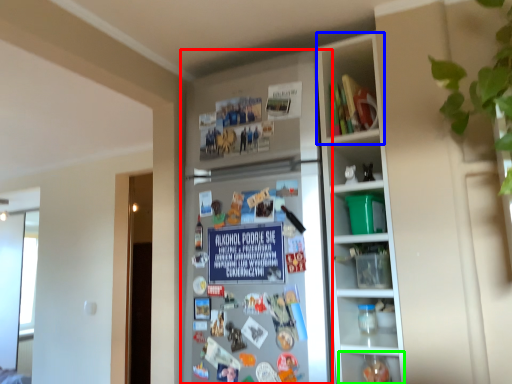
Question: Considering the real-world distances, which object is closest to fridge (highlighted by a red box)? cabinet (highlighted by a blue box) or shelf (highlighted by a green box).

Choices:
 (A) cabinet
 (B) shelf

Answer: (A)